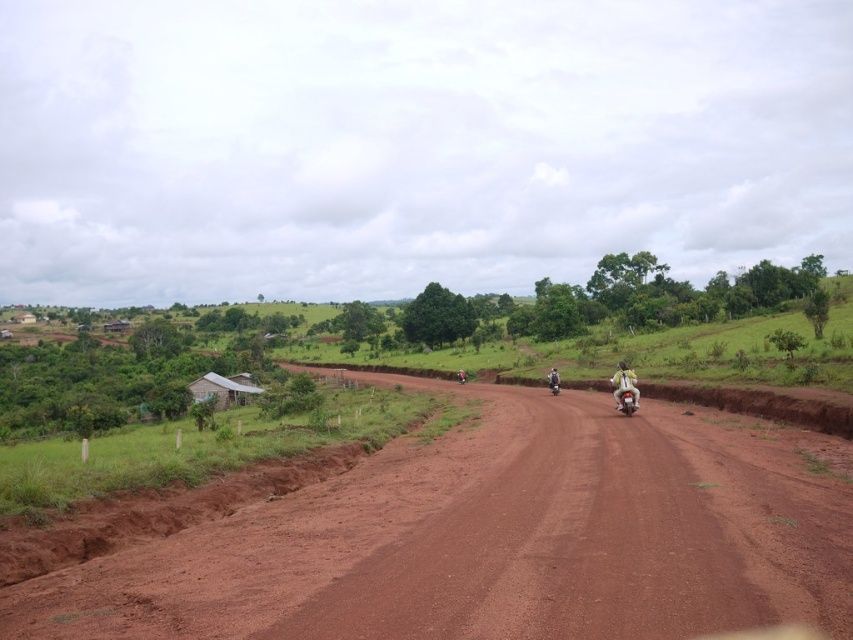
You are a photographer standing on the dirt road and want to capture both the light gray metallic motorcycle at right and the white plastic helmet at center in your photo. Which object should you focus on first to ensure it appears sharp in the foreground?

You should focus on the white plastic helmet at center first because it is closer to you than the light gray metallic motorcycle at right, which is positioned further away. This ensures the helmet will be sharp in the foreground while the motorcycle may appear slightly blurred if not focused properly.

You are a photographer standing at the starting point of the dirt road. You want to capture both the light gray metallic motorcycle at right and the white plastic helmet at center in your photo. Which object should you zoom in on to make them appear closer in size?

The light gray metallic motorcycle at right is smaller than the white plastic helmet at center, so you should zoom in on the light gray metallic motorcycle at right to make it appear larger and closer in size to the white plastic helmet at center.